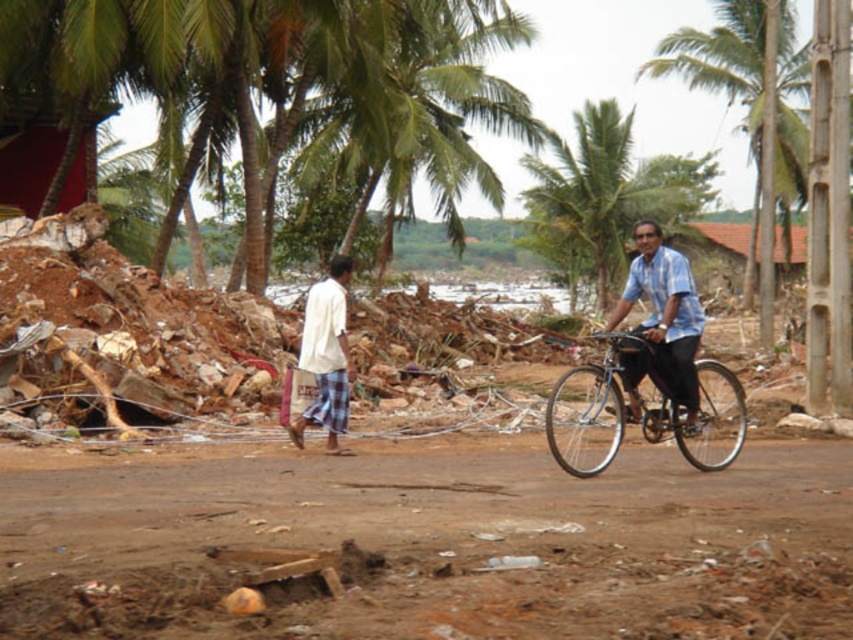
From the picture: You are a photographer trying to capture a photo of the blue shirt at center and the green leafy palm tree at upper right. Which object should you focus on first if you want to include both in the same frame without moving the camera?

The green leafy palm tree at upper right is bigger than the blue shirt at center, so you should focus on the larger object first to ensure it fills the frame appropriately while still capturing the smaller blue shirt at center in the same shot.

You are standing on the dirt road and want to take a photo of the blue shirt at center without the green leafy palm tree at upper right blocking the view. Is the palm tree too wide to avoid?

The green leafy palm tree at upper right is wider than the blue shirt at center, so it might block the view. Move to the side to avoid the palm tree.